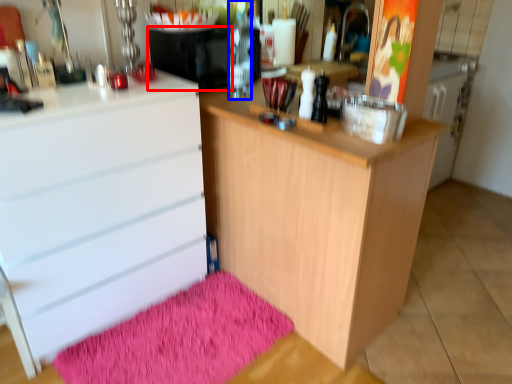
Question: Which object is further to the camera taking this photo, appliance (highlighted by a red box) or bottle (highlighted by a blue box)?

Choices:
 (A) appliance
 (B) bottle

Answer: (A)